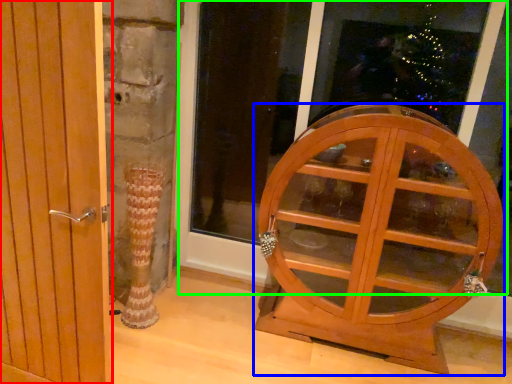
Question: Considering the real-world distances, which object is farthest from door (highlighted by a red box)? furniture (highlighted by a blue box) or window frame (highlighted by a green box)?

Choices:
 (A) furniture
 (B) window frame

Answer: (B)